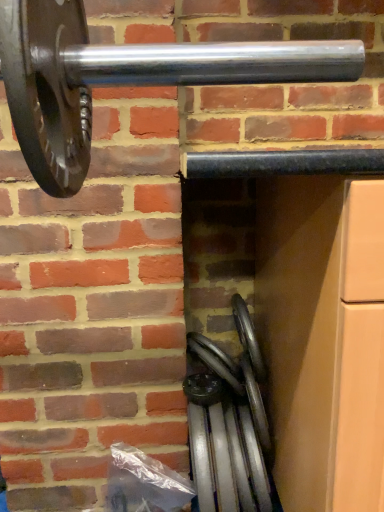
Question: Is metallic silver wheel at lower center, the 1th wheel positioned from the top, located outside polished silver wheel at lower center, which is counted as the 2th wheel, starting from the top?

Choices:
 (A) yes
 (B) no

Answer: (A)

Question: Are metallic silver wheel at lower center, the 1th wheel positioned from the top, and polished silver wheel at lower center, which is counted as the 1th wheel, starting from the bottom, far apart?

Choices:
 (A) no
 (B) yes

Answer: (A)

Question: Considering the relative positions of metallic silver wheel at lower center, the second wheel in the bottom-to-top sequence, and polished silver wheel at lower center, which is counted as the 2th wheel, starting from the top, in the image provided, is metallic silver wheel at lower center, the second wheel in the bottom-to-top sequence, to the right of polished silver wheel at lower center, which is counted as the 2th wheel, starting from the top, from the viewer's perspective?

Choices:
 (A) no
 (B) yes

Answer: (A)

Question: From the image's perspective, is metallic silver wheel at lower center, the second wheel in the bottom-to-top sequence, on polished silver wheel at lower center, which is counted as the 1th wheel, starting from the bottom?

Choices:
 (A) no
 (B) yes

Answer: (B)

Question: From a real-world perspective, is metallic silver wheel at lower center, the second wheel in the bottom-to-top sequence, physically above polished silver wheel at lower center, which is counted as the 1th wheel, starting from the bottom?

Choices:
 (A) yes
 (B) no

Answer: (A)

Question: Does metallic silver wheel at lower center, the second wheel in the bottom-to-top sequence, have a lesser width compared to polished silver wheel at lower center, which is counted as the 2th wheel, starting from the top?

Choices:
 (A) no
 (B) yes

Answer: (B)

Question: Would you consider polished silver wheel at lower center, which is counted as the 2th wheel, starting from the top, to be distant from metallic silver wheel at lower center, the 1th wheel positioned from the top?

Choices:
 (A) no
 (B) yes

Answer: (A)

Question: Does polished silver wheel at lower center, which is counted as the 2th wheel, starting from the top, touch metallic silver wheel at lower center, the 1th wheel positioned from the top?

Choices:
 (A) yes
 (B) no

Answer: (A)

Question: From the image's perspective, is polished silver wheel at lower center, which is counted as the 2th wheel, starting from the top, above metallic silver wheel at lower center, the 1th wheel positioned from the top?

Choices:
 (A) yes
 (B) no

Answer: (B)

Question: From a real-world perspective, is polished silver wheel at lower center, which is counted as the 2th wheel, starting from the top, over metallic silver wheel at lower center, the 1th wheel positioned from the top?

Choices:
 (A) yes
 (B) no

Answer: (B)

Question: From the image's perspective, is polished silver wheel at lower center, which is counted as the 2th wheel, starting from the top, below metallic silver wheel at lower center, the second wheel in the bottom-to-top sequence?

Choices:
 (A) no
 (B) yes

Answer: (B)

Question: Is polished silver wheel at lower center, which is counted as the 1th wheel, starting from the bottom, facing away from metallic silver wheel at lower center, the 1th wheel positioned from the top?

Choices:
 (A) yes
 (B) no

Answer: (B)

Question: From their relative heights in the image, would you say polished silver wheel at lower center, which is counted as the 1th wheel, starting from the bottom, is taller or shorter than metallic silver wheel at lower center, the 1th wheel positioned from the top?

Choices:
 (A) tall
 (B) short

Answer: (A)